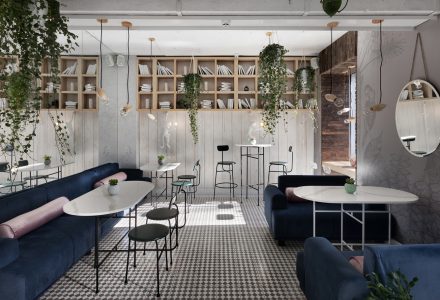
Find the location of a particular element. hanging lights is located at coordinates (377, 22), (336, 24), (152, 43), (124, 33), (97, 30).